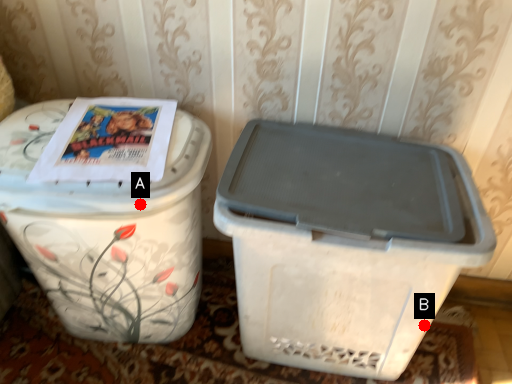
Question: Two points are circled on the image, labeled by A and B beside each circle. Which point is closer to the camera taking this photo?

Choices:
 (A) A is closer
 (B) B is closer

Answer: (A)